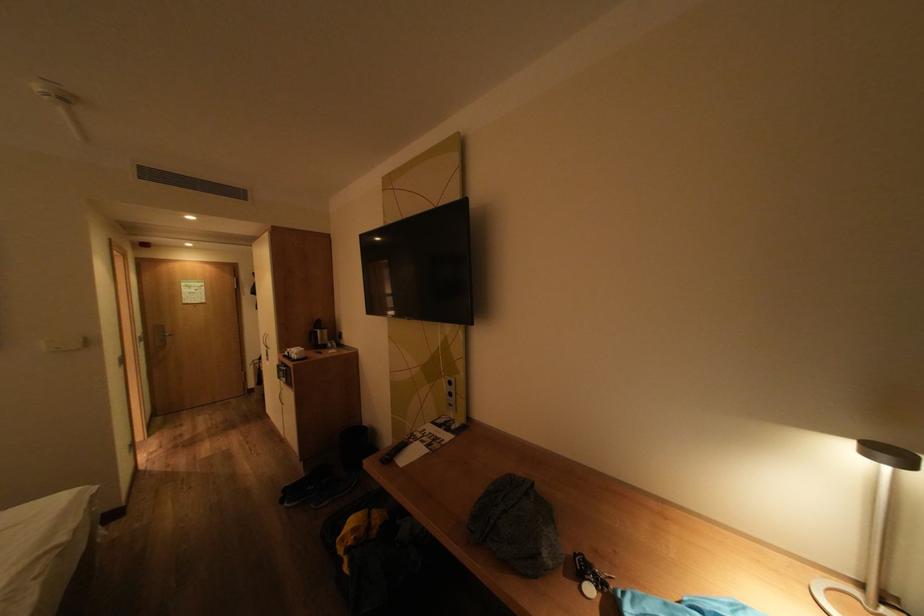
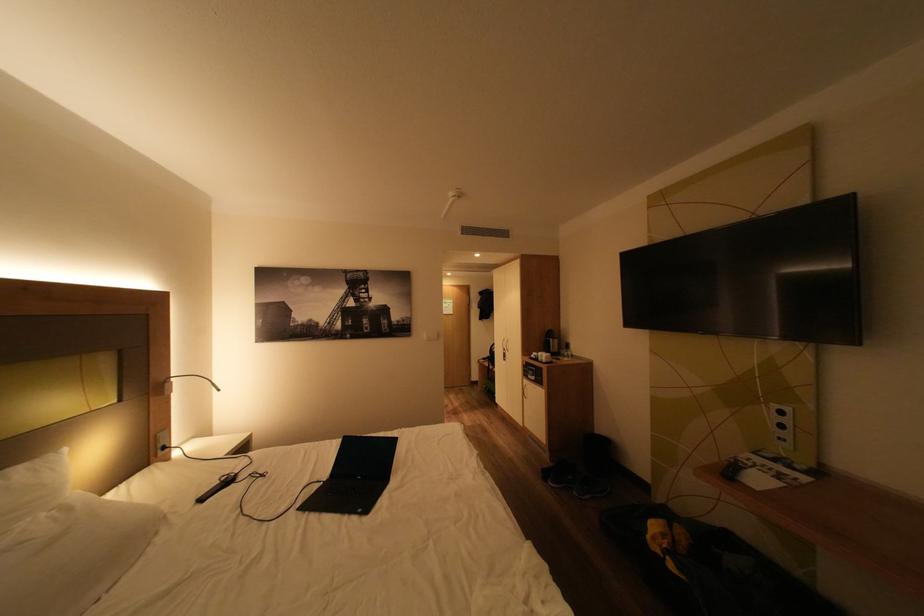
In the second image, find the point that corresponds to the point at 312,472 in the first image.

(560, 461)